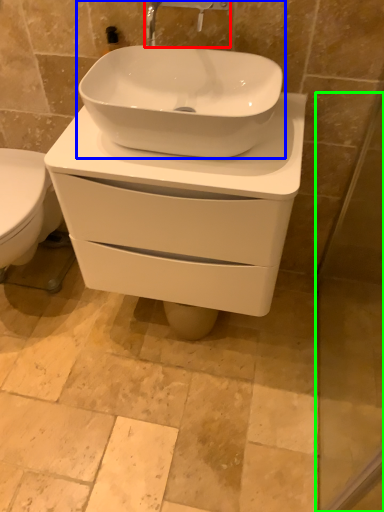
Question: Based on their relative distances, which object is nearer to tap (highlighted by a red box)? Choose from sink (highlighted by a blue box) and screen door (highlighted by a green box).

Choices:
 (A) sink
 (B) screen door

Answer: (A)